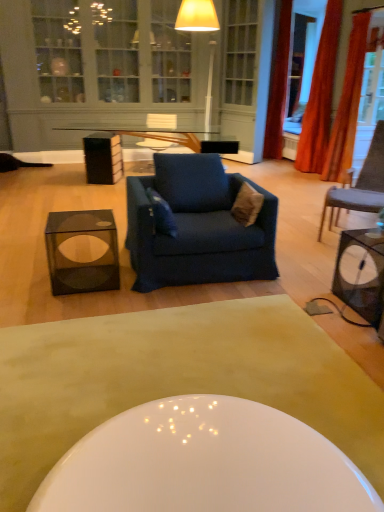
Question: Could you tell me if orange fabric curtain at right, the 3th curtain when ordered from back to front, is facing white glossy coffee table at center, arranged as the first coffee table when ordered from the bottom?

Choices:
 (A) yes
 (B) no

Answer: (B)

Question: Is orange fabric curtain at right, the 1th curtain from the front, wider than white glossy coffee table at center, which is the 1th coffee table from front to back?

Choices:
 (A) yes
 (B) no

Answer: (B)

Question: Is orange fabric curtain at right, the 3th curtain when ordered from back to front, completely or partially outside of white glossy coffee table at center, positioned as the second coffee table in back-to-front order?

Choices:
 (A) yes
 (B) no

Answer: (A)

Question: Considering the relative sizes of orange fabric curtain at right, the 1th curtain from the front, and white glossy coffee table at center, which is the 1th coffee table from front to back, in the image provided, is orange fabric curtain at right, the 1th curtain from the front, smaller than white glossy coffee table at center, which is the 1th coffee table from front to back,?

Choices:
 (A) yes
 (B) no

Answer: (B)

Question: Is orange fabric curtain at right, the 3th curtain when ordered from back to front, taller than white glossy coffee table at center, arranged as the first coffee table when ordered from the bottom?

Choices:
 (A) no
 (B) yes

Answer: (B)

Question: Could white glossy coffee table at center, positioned as the second coffee table in back-to-front order, be considered to be inside orange fabric curtain at right, the 3th curtain when ordered from back to front?

Choices:
 (A) yes
 (B) no

Answer: (B)

Question: Would you say velvet blue pillow at center, which is counted as the second pillow, starting from the right, contains orange fabric curtain at right, the 1th curtain from the front?

Choices:
 (A) yes
 (B) no

Answer: (B)

Question: Considering the relative sizes of velvet blue pillow at center, which is counted as the second pillow, starting from the right, and orange fabric curtain at right, the 3th curtain when ordered from back to front, in the image provided, is velvet blue pillow at center, which is counted as the second pillow, starting from the right, wider than orange fabric curtain at right, the 3th curtain when ordered from back to front,?

Choices:
 (A) yes
 (B) no

Answer: (B)

Question: Can you see velvet blue pillow at center, which is counted as the second pillow, starting from the right, touching orange fabric curtain at right, the 1th curtain from the front?

Choices:
 (A) no
 (B) yes

Answer: (A)

Question: Does velvet blue pillow at center, which is counted as the second pillow, starting from the right, have a smaller size compared to orange fabric curtain at right, the 1th curtain from the front?

Choices:
 (A) no
 (B) yes

Answer: (B)

Question: From the image's perspective, would you say velvet blue pillow at center, the first pillow positioned from the left, is shown under orange fabric curtain at right, the 3th curtain when ordered from back to front?

Choices:
 (A) no
 (B) yes

Answer: (B)

Question: Is velvet blue pillow at center, which is counted as the second pillow, starting from the right, looking in the opposite direction of orange fabric curtain at right, the 3th curtain when ordered from back to front?

Choices:
 (A) yes
 (B) no

Answer: (B)

Question: Is blue fabric armchair at center oriented towards transparent glass cube at lower left, which is the 1th table in left-to-right order?

Choices:
 (A) no
 (B) yes

Answer: (B)